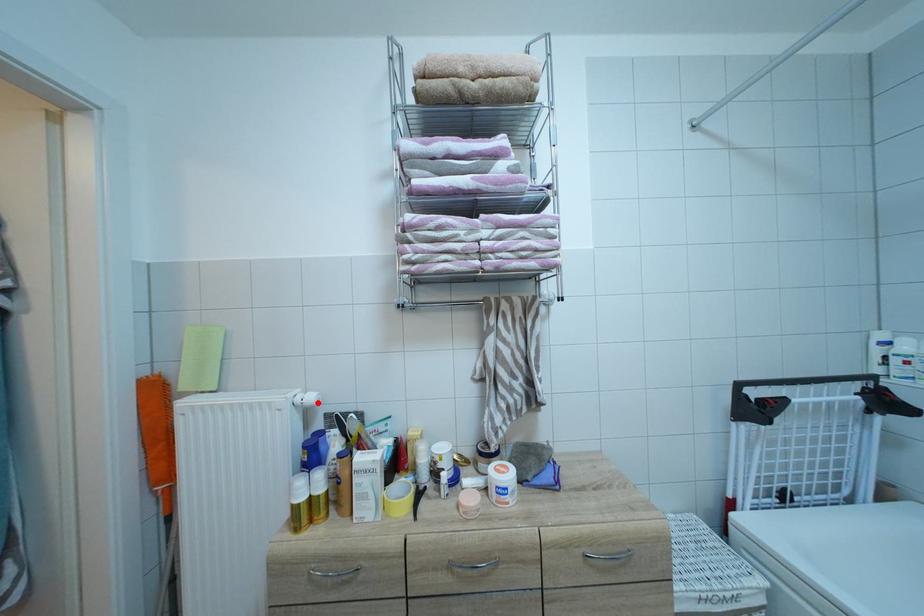
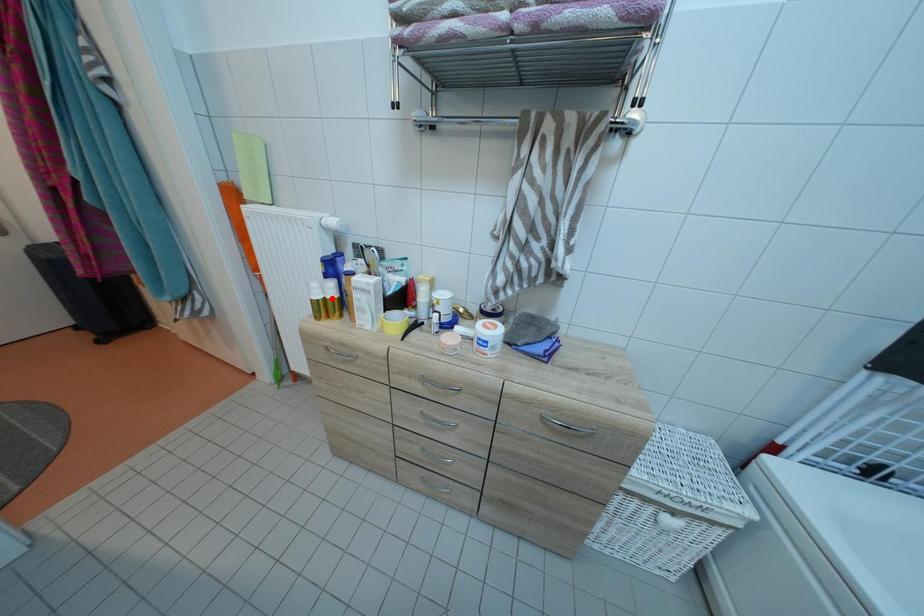
I am providing you with two images of the same scene from different viewpoints. A red point is marked on the first image and another point is marked on the second image. Do the highlighted points in image1 and image2 indicate the same real-world spot?

No